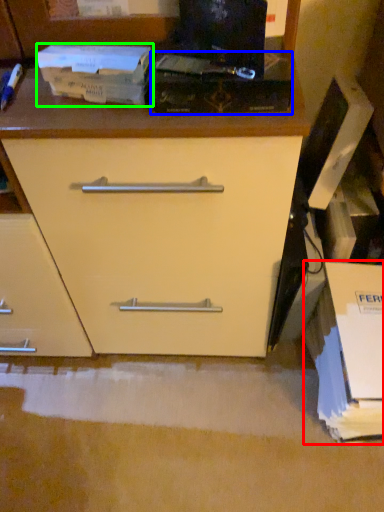
Question: Considering the real-world distances, which object is farthest from cardboard box (highlighted by a red box)? paperback book (highlighted by a blue box) or paperback book (highlighted by a green box)?

Choices:
 (A) paperback book
 (B) paperback book

Answer: (B)